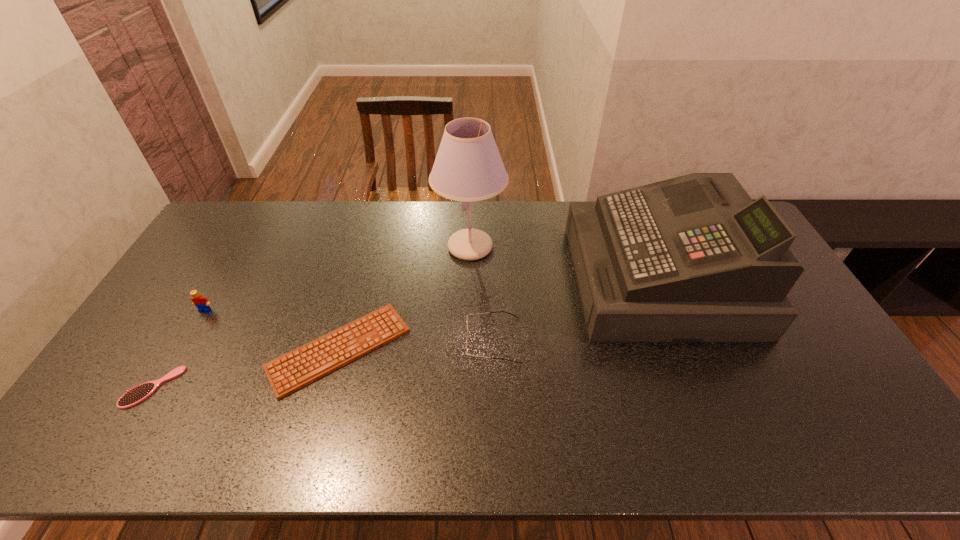
Find the location of `free space that satisfies the following two spatial constraints: 1. on the front-facing side of the Lego; 2. on the right side of the computer keyboard`. free space that satisfies the following two spatial constraints: 1. on the front-facing side of the Lego; 2. on the right side of the computer keyboard is located at coordinates (182, 349).

At what (x,y) coordinates should I click in order to perform the action: click on free space in the image that satisfies the following two spatial constraints: 1. on the front-facing side of the cash register; 2. on the front-facing side of the Lego. Please return your answer as a coordinate pair (x, y). The height and width of the screenshot is (540, 960). Looking at the image, I should click on (671, 310).

Where is `vacant space that satisfies the following two spatial constraints: 1. through the lenses of the spectacles; 2. on the front side of the second shortest object`? Image resolution: width=960 pixels, height=540 pixels. vacant space that satisfies the following two spatial constraints: 1. through the lenses of the spectacles; 2. on the front side of the second shortest object is located at coordinates (494, 387).